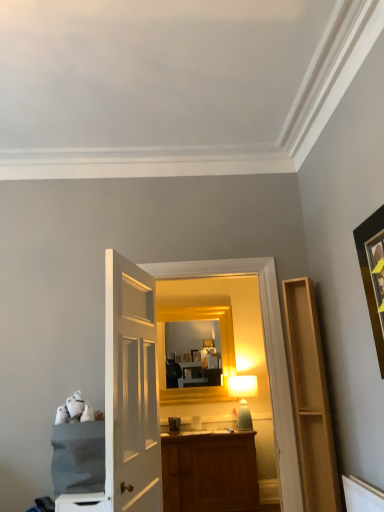
Question: Does point (254, 386) appear closer or farther from the camera than point (314, 494)?

Choices:
 (A) closer
 (B) farther

Answer: (B)

Question: Considering the positions of matte white table lamp at center and light wood shelf at right, acting as the 2th cabinetry starting from the left, in the image, is matte white table lamp at center taller or shorter than light wood shelf at right, acting as the 2th cabinetry starting from the left,?

Choices:
 (A) short
 (B) tall

Answer: (A)

Question: Which object is positioned closest to the denim fabric cabinet at left, the first cabinetry when ordered from left to right?

Choices:
 (A) matte white table lamp at center
 (B) black matte picture frame at upper right
 (C) light wood shelf at right, acting as the 1th cabinetry starting from the right

Answer: (C)

Question: Which of these objects is positioned farthest from the denim fabric cabinet at left, the first cabinetry when ordered from left to right?

Choices:
 (A) matte white table lamp at center
 (B) black matte picture frame at upper right
 (C) light wood shelf at right, acting as the 2th cabinetry starting from the left

Answer: (A)